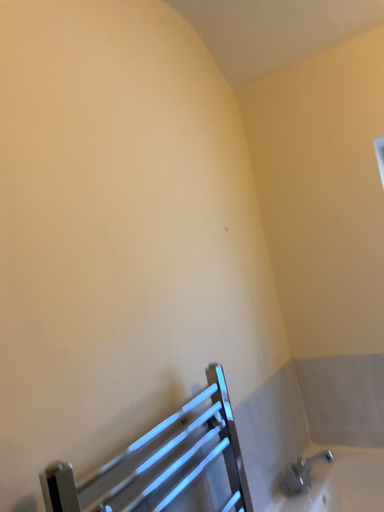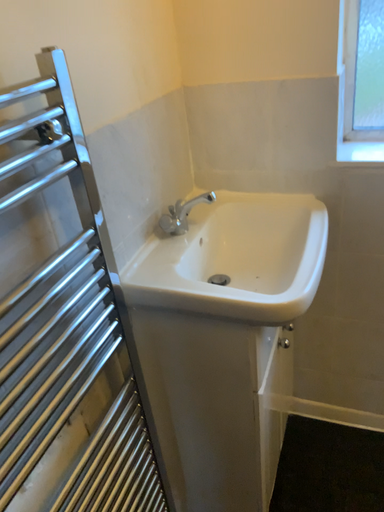
Question: Which way did the camera rotate in the video?

Choices:
 (A) rotated upward
 (B) rotated downward

Answer: (B)